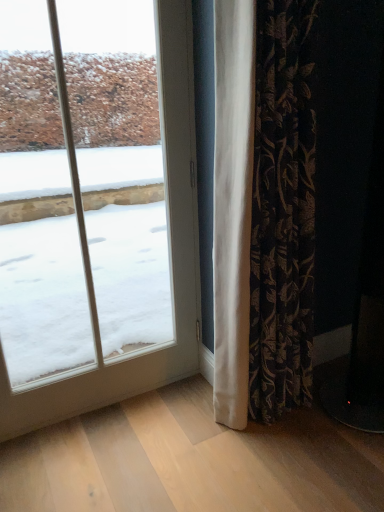
What is the approximate height of transparent glass window at left?

transparent glass window at left is 1.72 meters tall.

Image resolution: width=384 pixels, height=512 pixels. I want to click on transparent glass window at left, so click(x=170, y=261).

Describe the element at coordinates (170, 261) in the screenshot. I see `transparent glass window at left` at that location.

The width and height of the screenshot is (384, 512). I want to click on transparent glass window at left, so click(x=170, y=261).